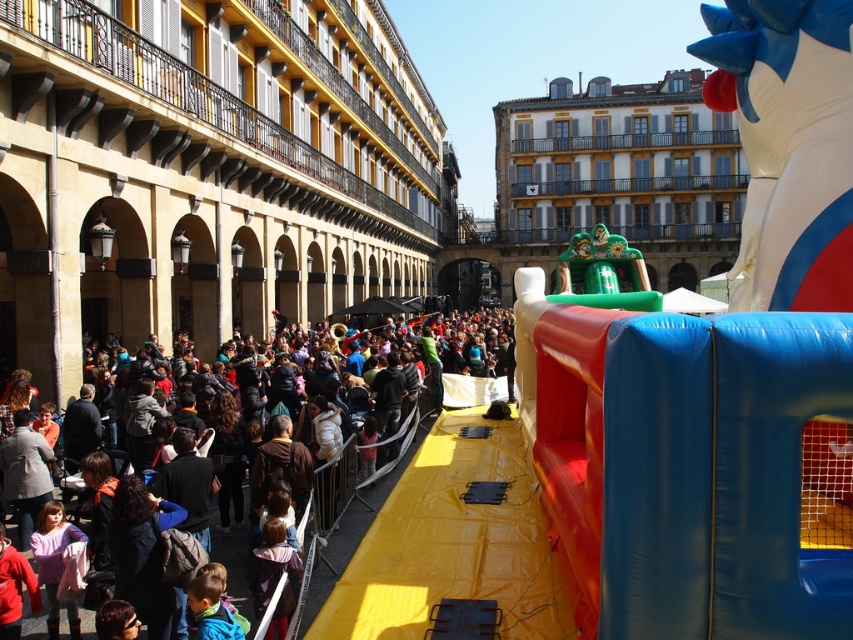
You are a photographer standing in front of the inflatable structure. You want to take a photo that includes both the multicolored fabric crowd at center and the light brown hair at lower center. Which object should you focus on first to ensure both are in the frame?

You should focus on the multicolored fabric crowd at center first since it is closer to the viewer than the light brown hair at lower center, ensuring both are in the frame by adjusting the camera angle accordingly.

You are a visitor at this event and want to take a photo of the blue rubber slide at center from where you are standing. Considering the distance, would you need a zoom lens to capture the entire slide in the frame?

The blue rubber slide at center is 26.29 meters away from the camera. Since this distance is quite far, using a zoom lens would be necessary to ensure the entire slide fits within the camera frame.